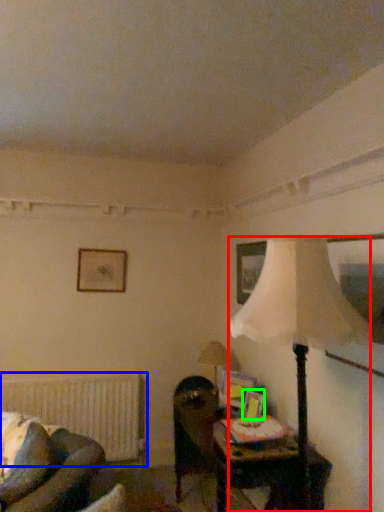
Question: Which is nearer to the lamp (highlighted by a red box)? radiator (highlighted by a blue box) or picture frame (highlighted by a green box).

Choices:
 (A) radiator
 (B) picture frame

Answer: (B)